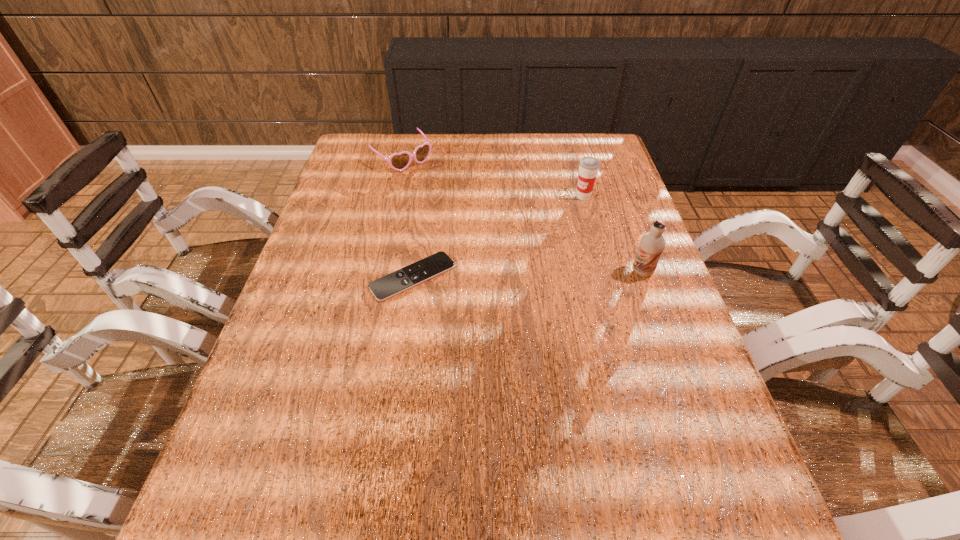
Find the location of a particular element. The height and width of the screenshot is (540, 960). vacant space on the desktop that is between the shortest object and the rightmost object and is positioned on the side of the cup with the logo is located at coordinates (518, 275).

You are a GUI agent. You are given a task and a screenshot of the screen. Output one action in this format:
    pyautogui.click(x=<x>, y=<y>)
    Task: Click on the free space on the desktop that is between the remote control and the rightmost object and is positioned on the front-facing side of the sunglasses
    
    Given the screenshot: What is the action you would take?
    pyautogui.click(x=535, y=274)